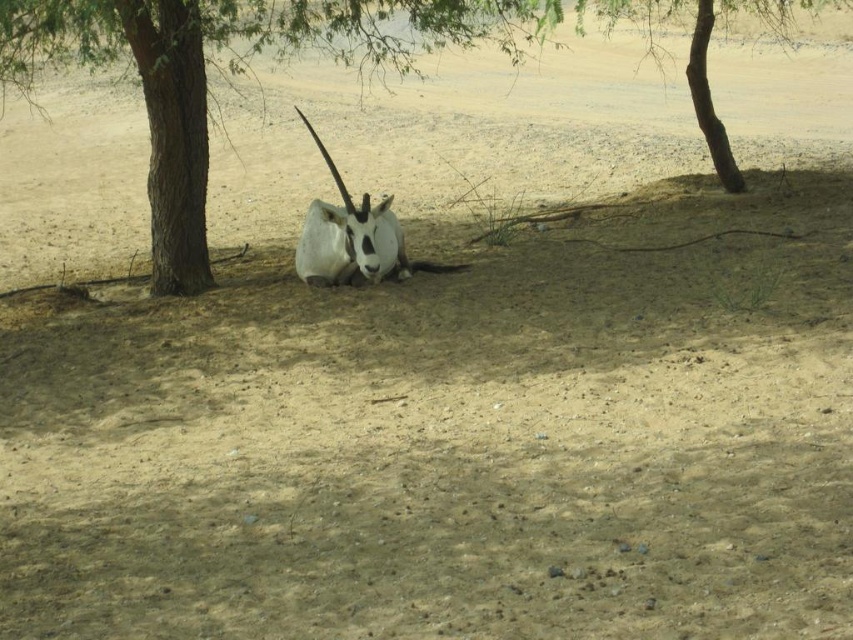
Question: Which of these objects is positioned farthest from the white matte antelope at center?

Choices:
 (A) brown rough tree at left
 (B) brown rough tree at upper center

Answer: (B)

Question: Which object appears farthest from the camera in this image?

Choices:
 (A) brown rough tree at left
 (B) brown rough tree at upper center
 (C) white matte antelope at center

Answer: (C)

Question: Is brown rough tree at upper center positioned behind white matte antelope at center?

Choices:
 (A) yes
 (B) no

Answer: (B)

Question: Can you confirm if brown rough tree at upper center is positioned above white matte antelope at center?

Choices:
 (A) no
 (B) yes

Answer: (B)

Question: Which point is farther to the camera?

Choices:
 (A) tap(749, 8)
 (B) tap(328, 202)

Answer: (A)

Question: Can you confirm if brown rough tree at left is positioned to the left of white matte antelope at center?

Choices:
 (A) no
 (B) yes

Answer: (B)